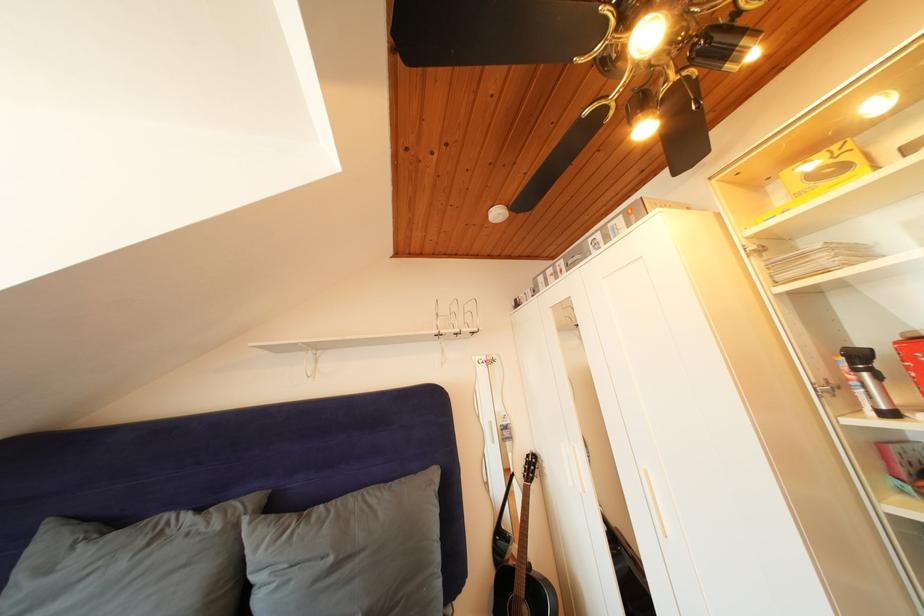
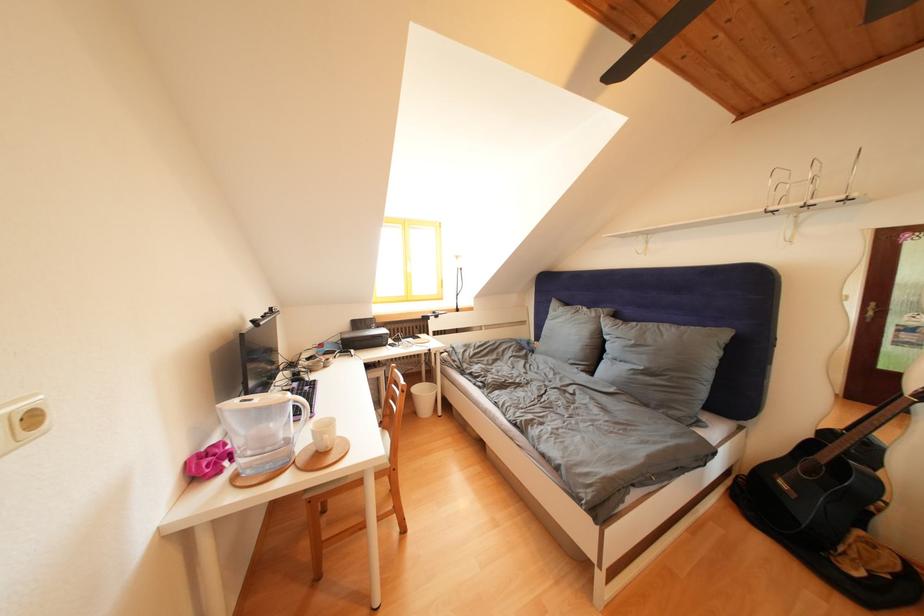
In the second image, find the point that corresponds to point 225,531 in the first image.

(602, 320)